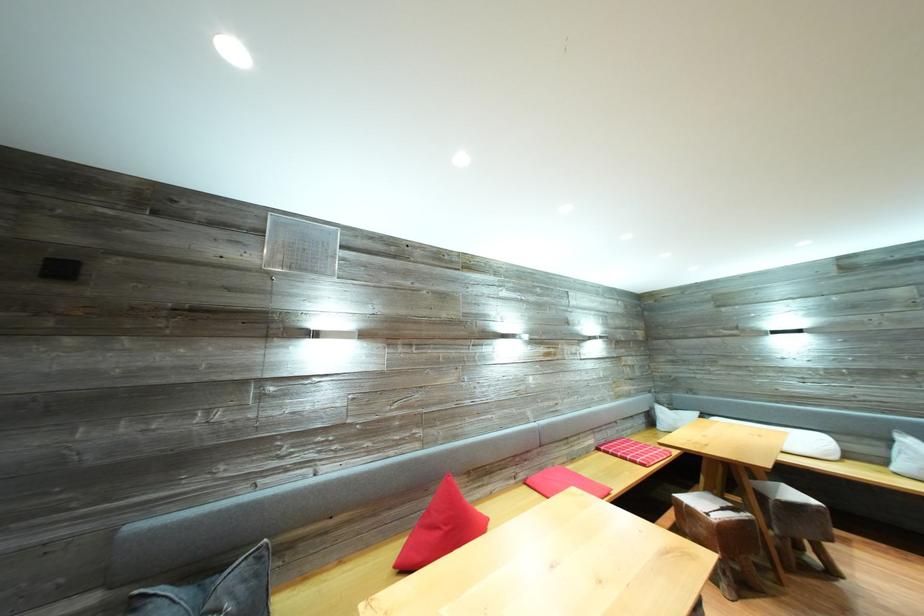
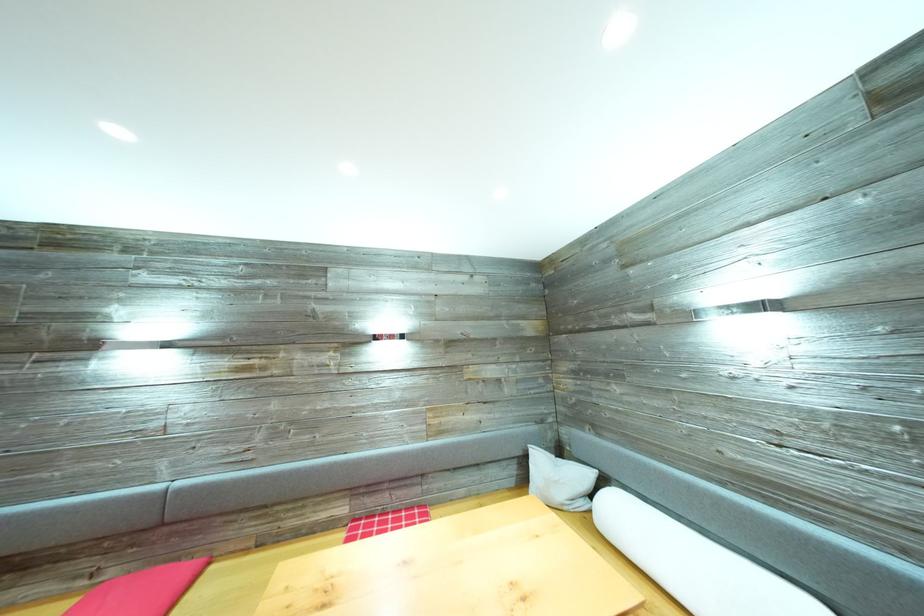
What movement of the cameraman would produce the second image?

The cameraman walked toward right, forward.